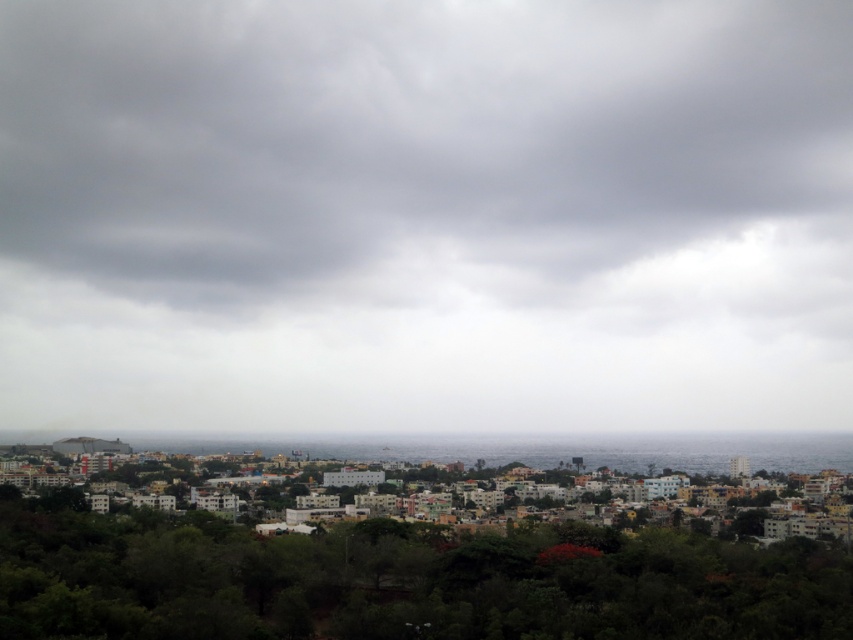
Which is above, gray cloudy sky at upper center or green leafy trees at lower center?

gray cloudy sky at upper center is above.

Which is below, gray cloudy sky at upper center or green leafy trees at lower center?

Positioned lower is green leafy trees at lower center.

This screenshot has width=853, height=640. I want to click on gray cloudy sky at upper center, so click(x=425, y=216).

The image size is (853, 640). I want to click on gray cloudy sky at upper center, so click(x=425, y=216).